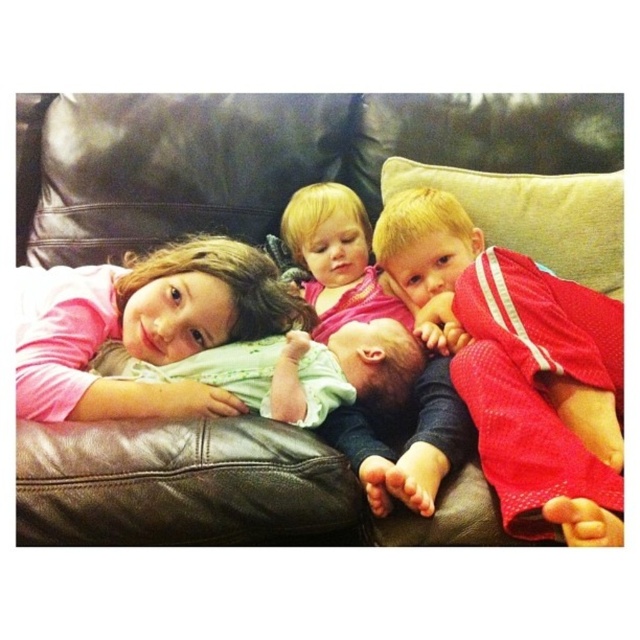
Does brown leather couch at center appear on the left side of pink fabric baby at center?

Indeed, brown leather couch at center is positioned on the left side of pink fabric baby at center.

Does brown leather couch at center have a lesser height compared to pink fabric baby at center?

Yes, brown leather couch at center is shorter than pink fabric baby at center.

Does point (36, 253) come closer to viewer compared to point (433, 464)?

No, it is not.

Locate an element on the screen. brown leather couch at center is located at coordinates (292, 163).

Is point (240, 497) less distant than point (120, 326)?

Yes, it is in front of point (120, 326).

Can you confirm if brown leather couch at center is positioned to the right of pink matte shirt at upper left?

Correct, you'll find brown leather couch at center to the right of pink matte shirt at upper left.

The width and height of the screenshot is (640, 640). I want to click on brown leather couch at center, so click(x=292, y=163).

Can you confirm if pink fabric baby at center is taller than soft green fabric baby at center?

Yes.

Does pink fabric baby at center have a smaller size compared to soft green fabric baby at center?

Actually, pink fabric baby at center might be larger than soft green fabric baby at center.

Is point (300, 236) closer to camera compared to point (342, 360)?

That is False.

I want to click on pink fabric baby at center, so click(406, 436).